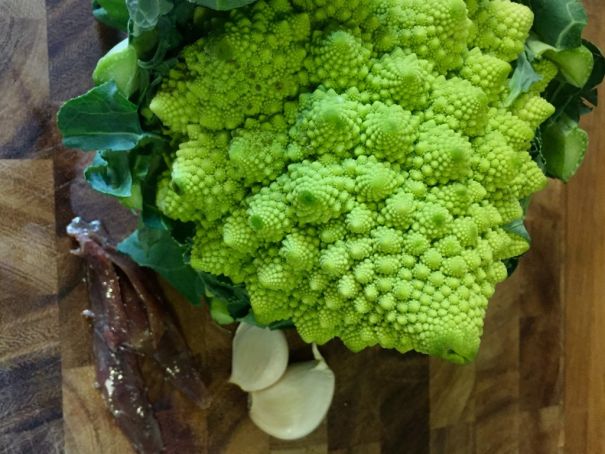
Identify the location of cutting board. (522, 377).